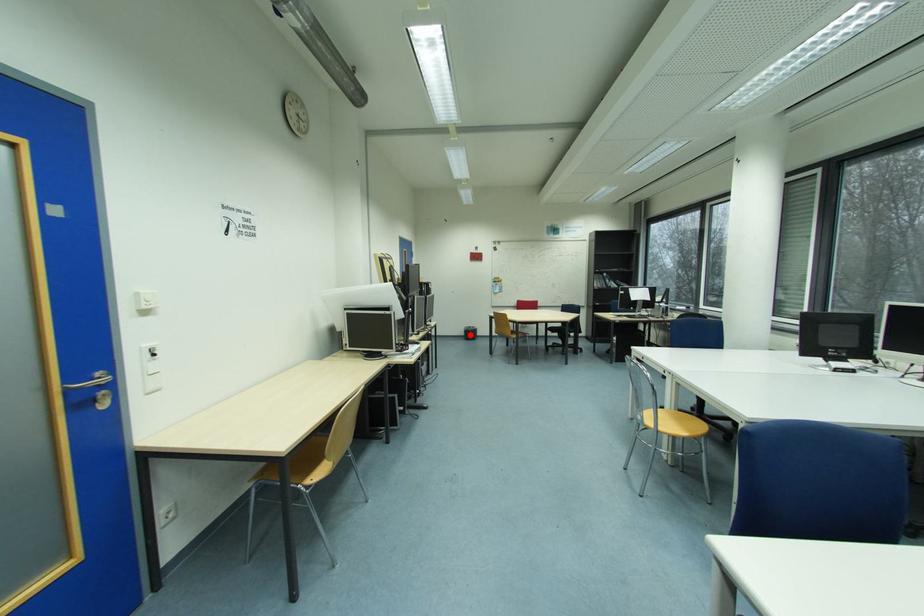
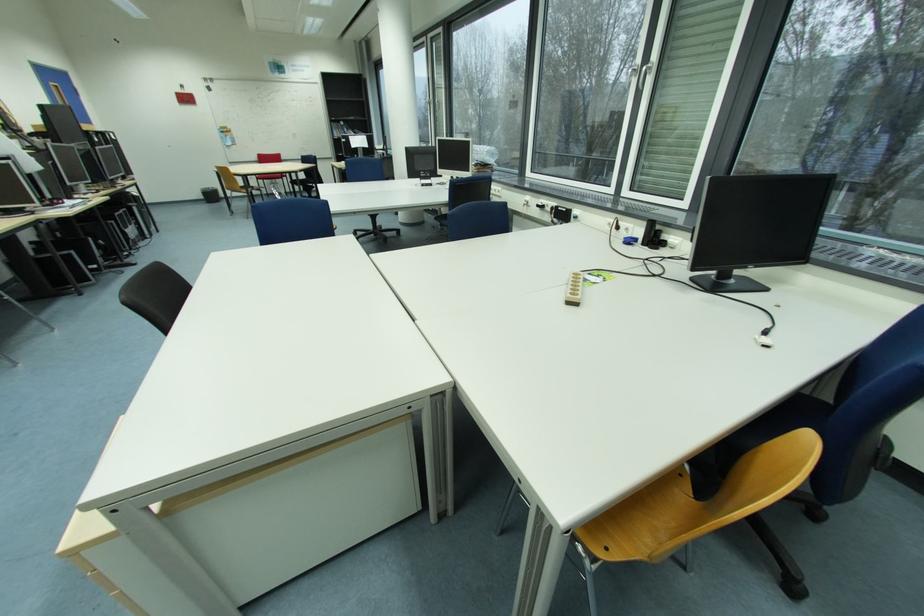
Find the pixel in the second image that matches the highlighted location in the first image.

(209, 198)